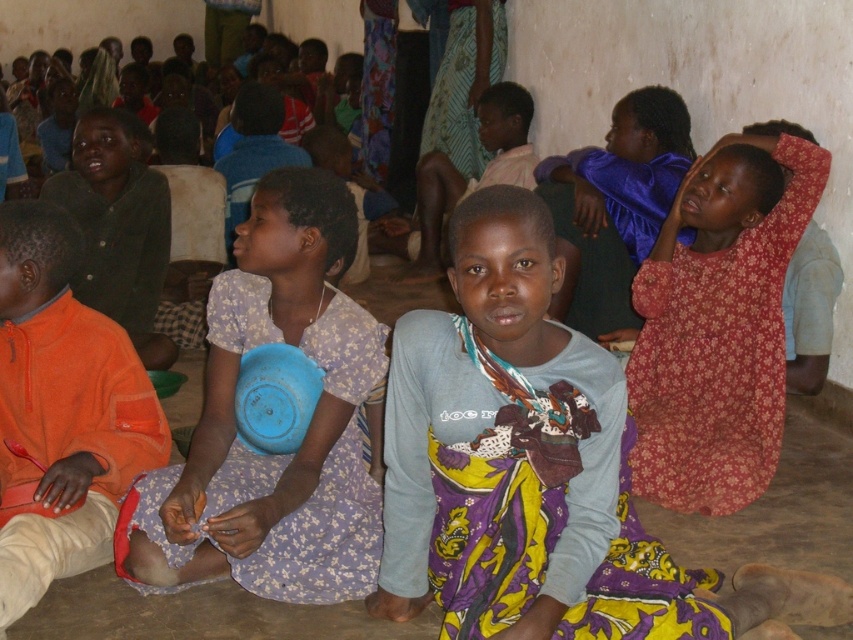
Question: Can you confirm if purple floral dress at center is wider than shiny purple blouse at upper right?

Choices:
 (A) yes
 (B) no

Answer: (A)

Question: Is purple floral dress at center positioned at the back of light blue fabric shirt at center?

Choices:
 (A) no
 (B) yes

Answer: (A)

Question: Which point is closer to the camera?

Choices:
 (A) (654, 145)
 (B) (527, 148)
 (C) (312, 170)

Answer: (C)

Question: Does light blue shirt with patterned wrap at center appear under shiny purple blouse at upper right?

Choices:
 (A) yes
 (B) no

Answer: (A)

Question: Which point appears closest to the camera in this image?

Choices:
 (A) (317, 404)
 (B) (10, 432)
 (C) (143, 224)

Answer: (A)

Question: Among these points, which one is nearest to the camera?

Choices:
 (A) (108, 241)
 (B) (534, 611)
 (C) (4, 266)

Answer: (B)